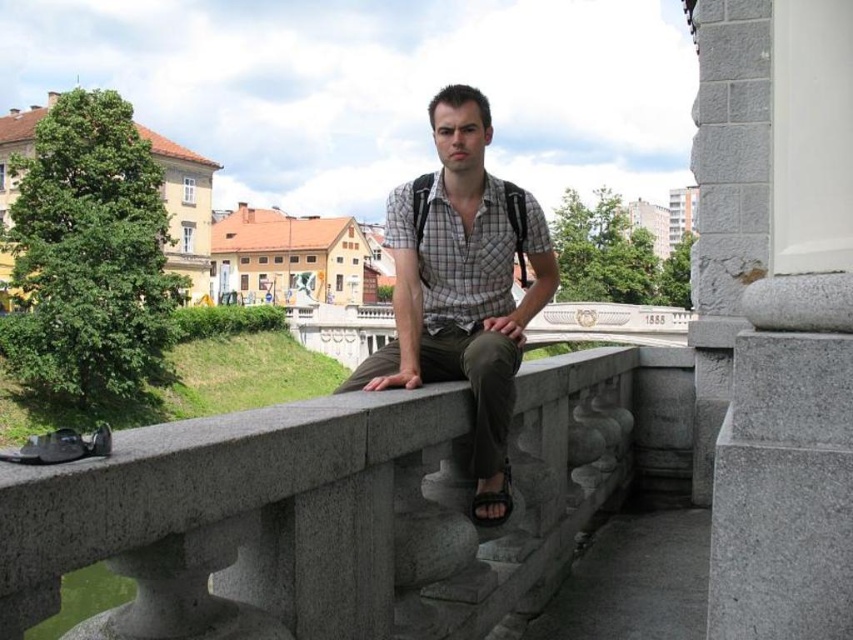
Looking at this image, you are a photographer trying to capture the man in the image. Since you want to focus on the gray stone rail at center and the black leather sandal at lower center, which object should you zoom in on to ensure it takes up more space in your photo?

The gray stone rail at center should be zoomed in on because it has a larger size compared to the black leather sandal at lower center, making it the better choice for taking up more space in the photo.

You are a fashion designer observing the man in the scene. You need to determine which item of clothing or accessory is bigger between the checkered fabric shirt at center and the black leather sandal at lower center. Which one is larger?

The checkered fabric shirt at center is larger in size than the black leather sandal at lower center.

You are a fashion designer analyzing the man in the image. You need to determine which item of clothing is taller between the checkered fabric shirt at center and the black leather sandal at lower center. Which one is taller?

The checkered fabric shirt at center is taller than the black leather sandal at lower center according to the description.